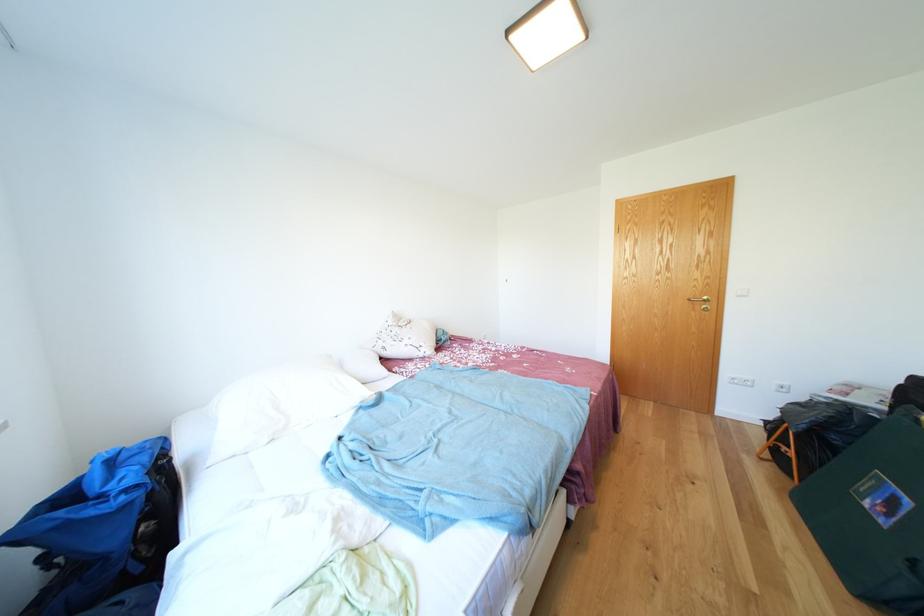
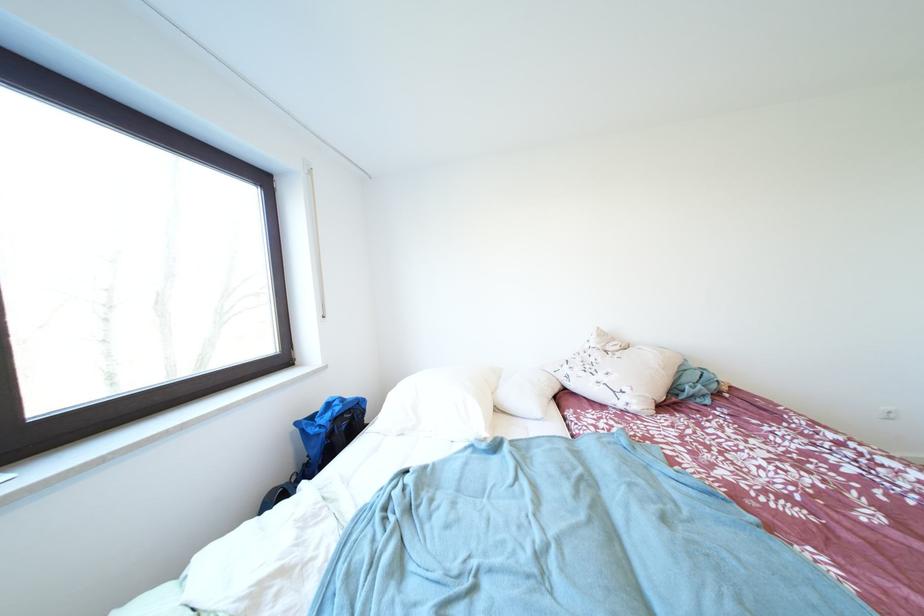
Question: How did the camera likely rotate?

Choices:
 (A) Left
 (B) Right
 (C) Up
 (D) Down

Answer: (A)